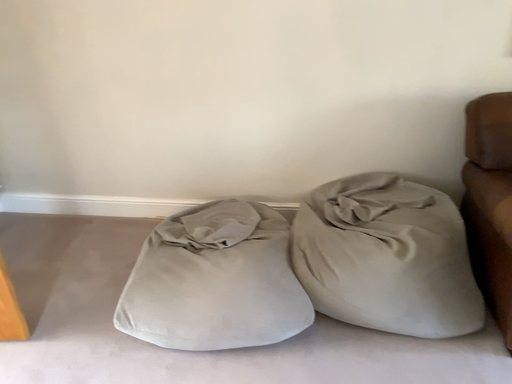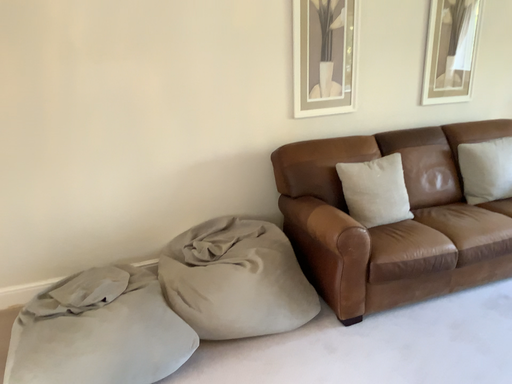
Question: Which way did the camera rotate in the video?

Choices:
 (A) rotated upward
 (B) rotated downward

Answer: (A)